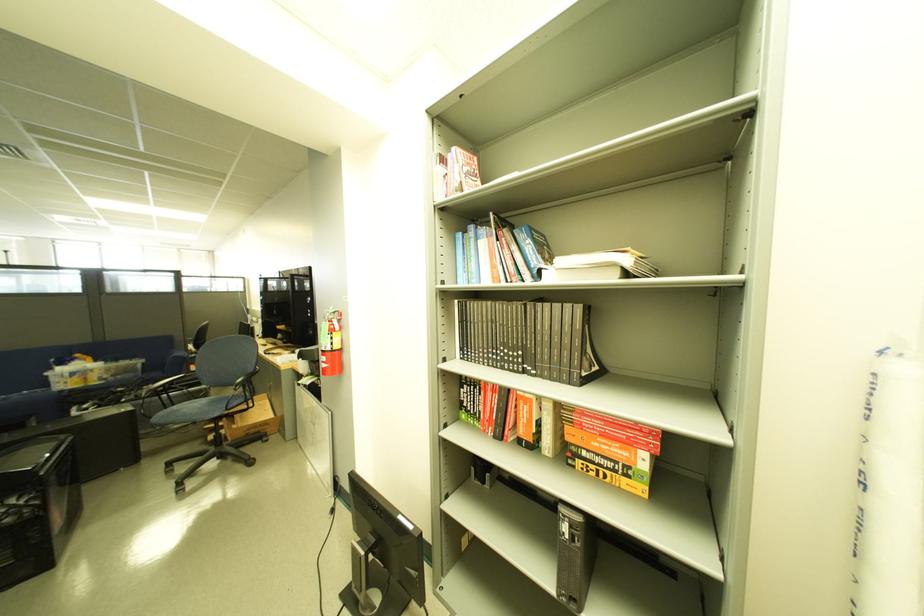
The height and width of the screenshot is (616, 924). I want to click on orange paperback book, so click(x=611, y=448).